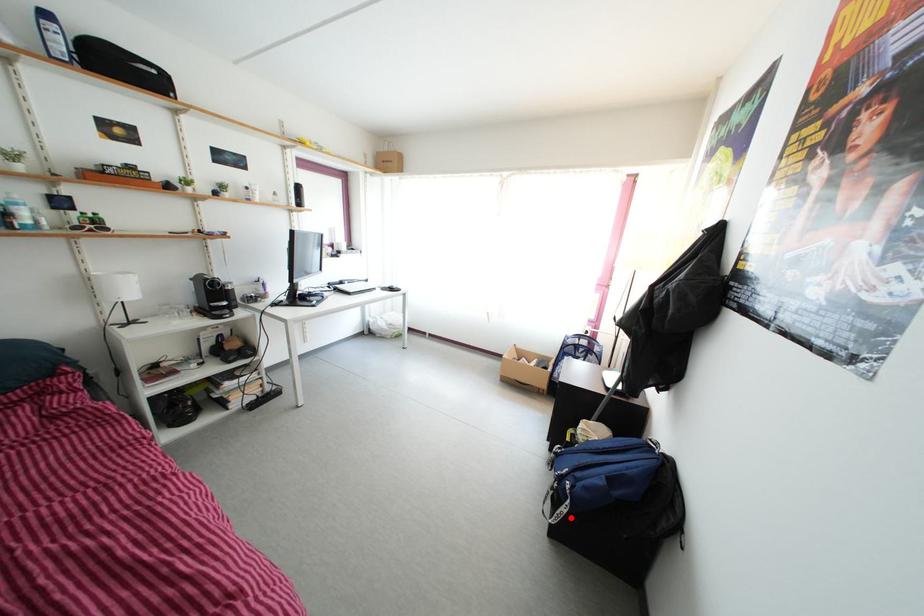
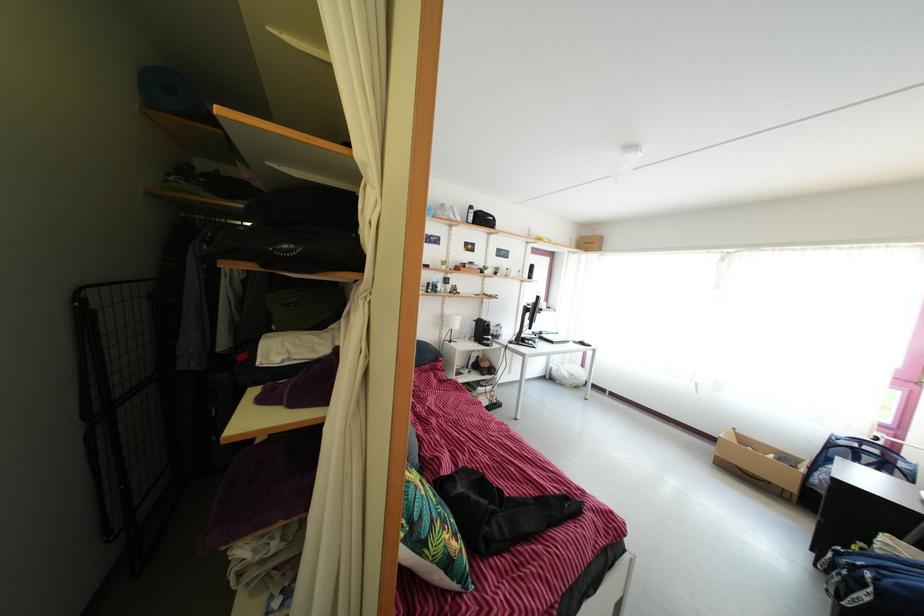
Question: I am providing you with two images of the same scene from different viewpoints. A red point is marked on the first image. At the location where the point appears in image 1, is it still visible in image 2?

Choices:
 (A) Yes
 (B) No

Answer: (A)